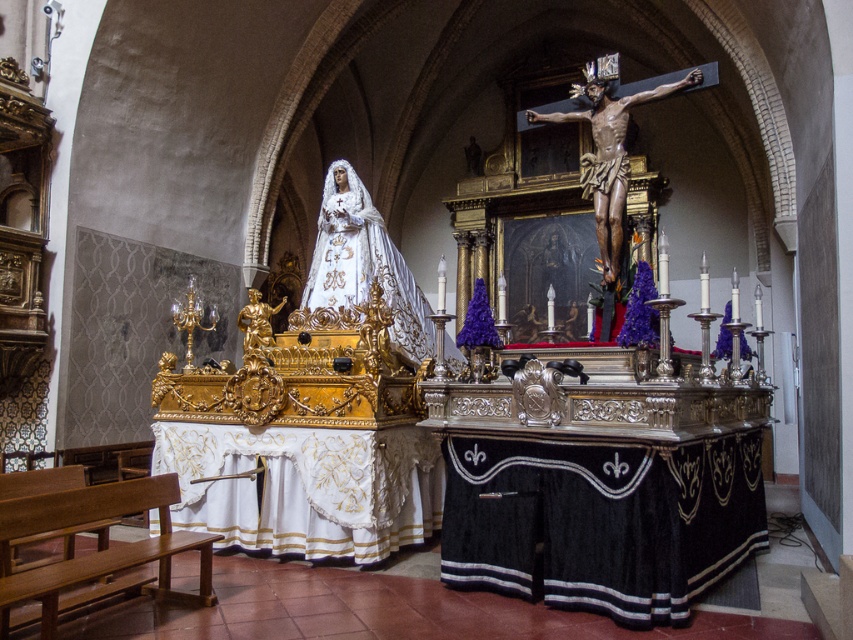
Question: Which object appears farthest from the camera in this image?

Choices:
 (A) white satin statue at center
 (B) polished bronze crucifix at center
 (C) wooden bench at lower left

Answer: (A)

Question: Based on their relative distances, which object is nearer to the polished bronze crucifix at center?

Choices:
 (A) wooden bench at lower left
 (B) white satin statue at center

Answer: (B)

Question: In this image, where is white satin statue at center located relative to polished bronze crucifix at center?

Choices:
 (A) left
 (B) right

Answer: (A)

Question: Is the position of white satin statue at center more distant than that of polished bronze crucifix at center?

Choices:
 (A) yes
 (B) no

Answer: (A)

Question: Considering the real-world distances, which object is farthest from the wooden bench at lower left?

Choices:
 (A) polished bronze crucifix at center
 (B) white satin statue at center

Answer: (A)

Question: From the image, what is the correct spatial relationship of wooden bench at lower left in relation to polished bronze crucifix at center?

Choices:
 (A) above
 (B) below

Answer: (B)